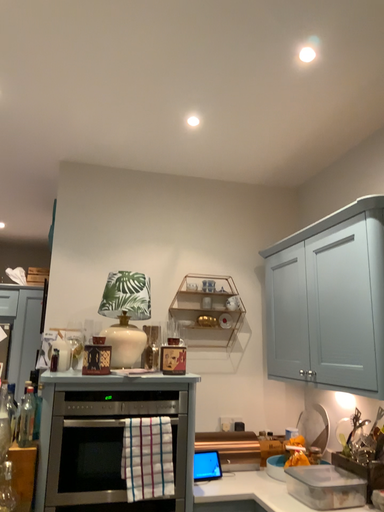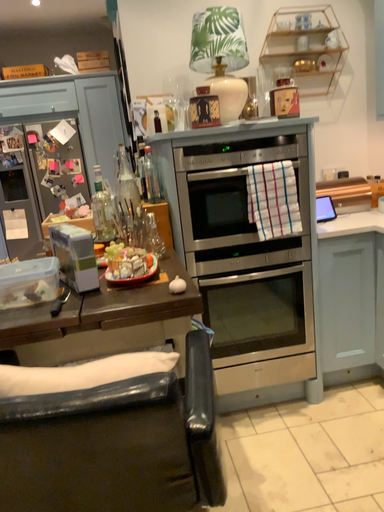
Question: Which way did the camera rotate in the video?

Choices:
 (A) rotated downward
 (B) rotated upward

Answer: (A)